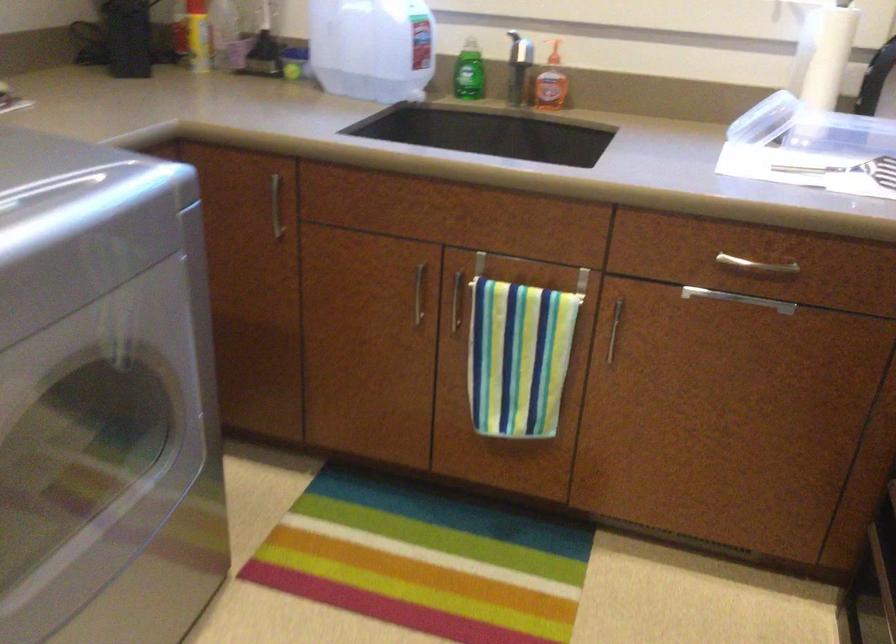
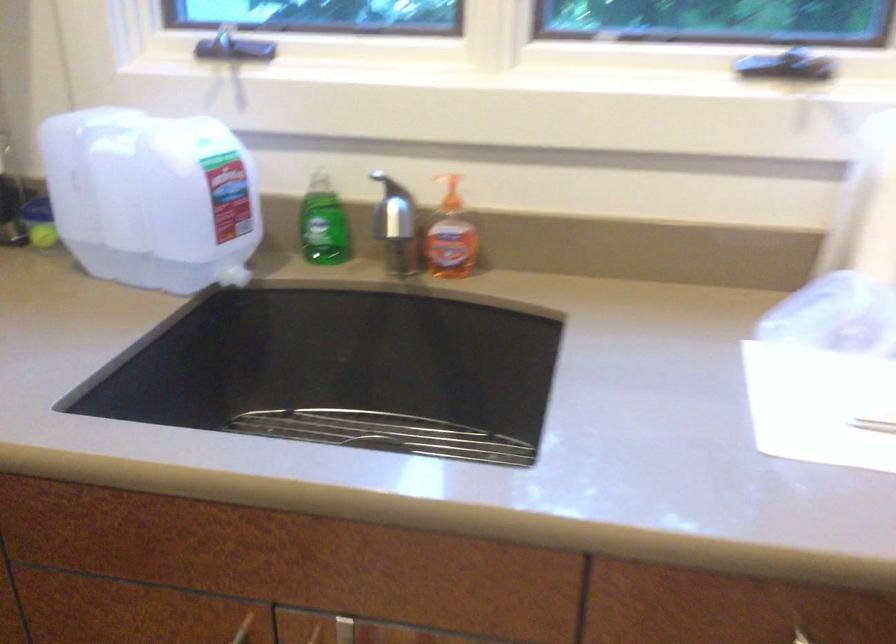
Question: The camera is either moving clockwise (left) or counter-clockwise (right) around the object. The first image is from the beginning of the video and the second image is from the end. Is the camera moving left or right when shooting the video?

Choices:
 (A) Left
 (B) Right

Answer: (A)